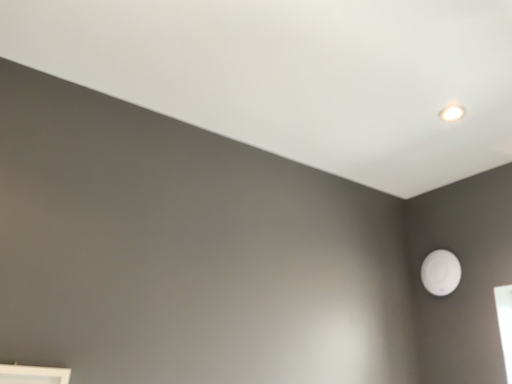
Find the location of `white matte light fixture at upper right`. white matte light fixture at upper right is located at coordinates (441, 272).

This screenshot has width=512, height=384. Describe the element at coordinates (441, 272) in the screenshot. I see `white matte light fixture at upper right` at that location.

The width and height of the screenshot is (512, 384). Identify the location of white matte light fixture at upper right. (441, 272).